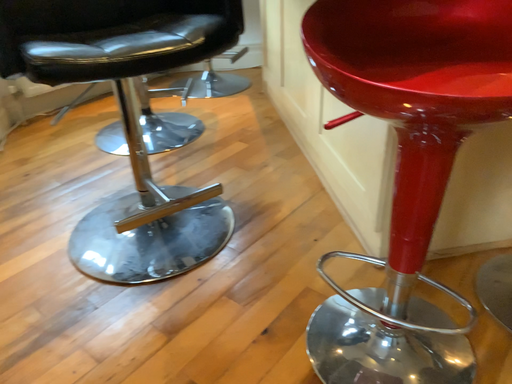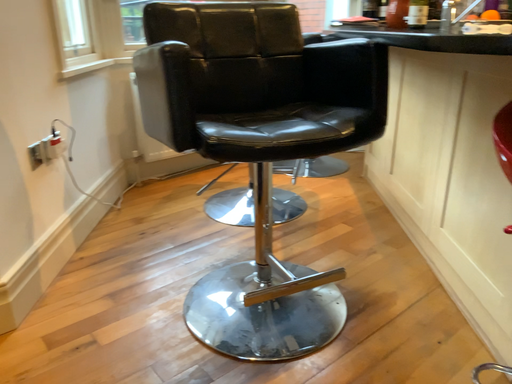
Question: Which way did the camera rotate in the video?

Choices:
 (A) rotated upward
 (B) rotated downward

Answer: (A)